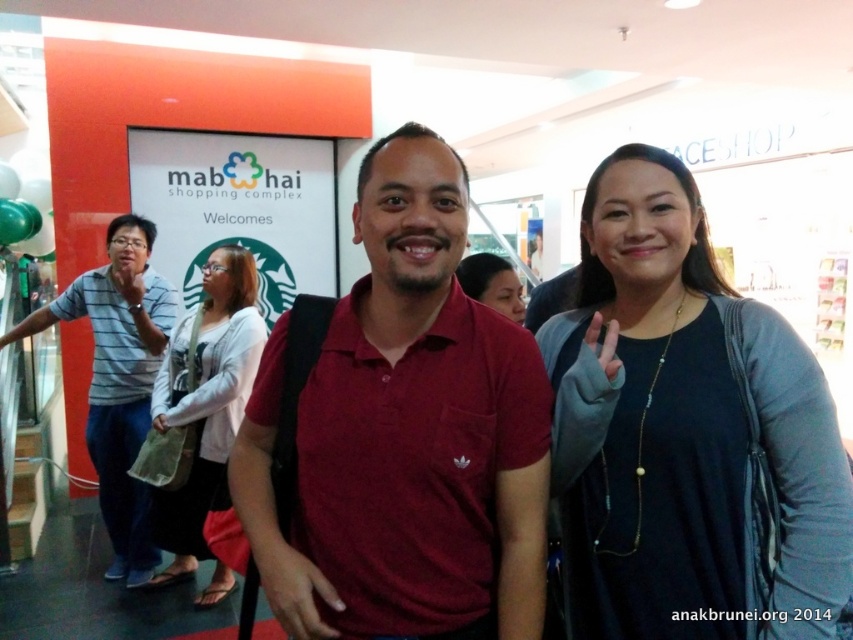
Looking at this image, you are a photographer standing in the shopping mall and want to take a picture of the black matte shirt at center and the matte black hair at center. Which object should you focus on first if you want to capture both in the same frame without moving the camera?

The black matte shirt at center is taller than the matte black hair at center, so you should focus on the black matte shirt at center first to ensure both are in the frame.